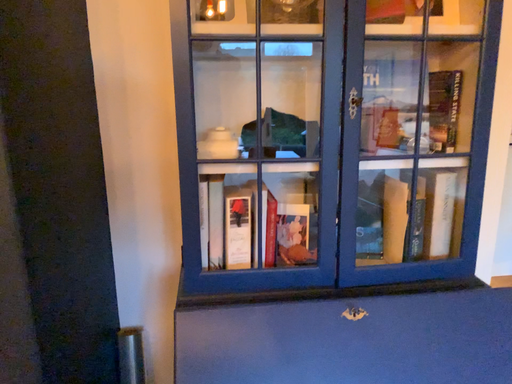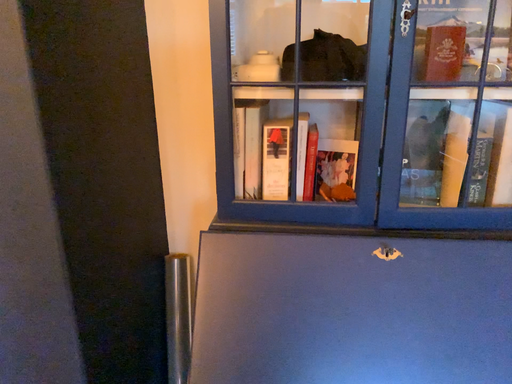
Question: How did the camera likely rotate when shooting the video?

Choices:
 (A) rotated left
 (B) rotated right

Answer: (A)